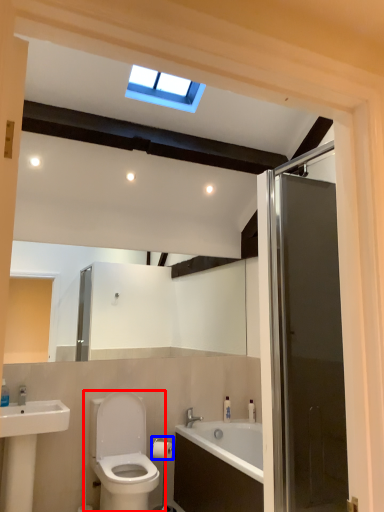
Question: Which object appears farthest to the camera in this image, toilet (highlighted by a red box) or towel bar (highlighted by a blue box)?

Choices:
 (A) toilet
 (B) towel bar

Answer: (B)